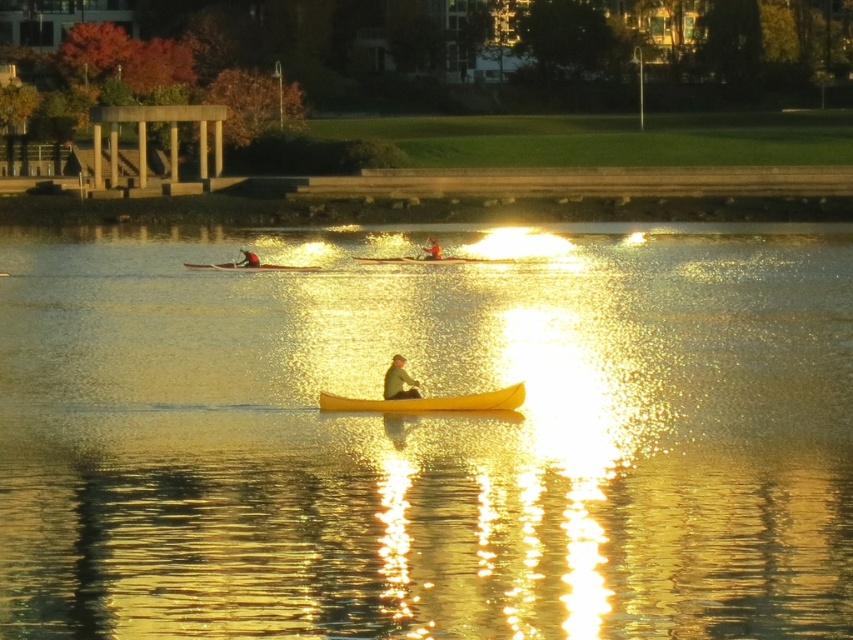
You are standing at the camera position and want to throw a lifebuoy to the person in the yellow matte canoe at center. The lifebuoy can travel 25 meters. Will it reach them?

The yellow matte canoe at center is 28.45 meters from the camera. Since the lifebuoy can only travel 25 meters, it will not reach them.

You are a photographer trying to capture a clear shot of the yellow matte canoe at center and the green fabric jacket at center. Since you want to focus on the larger object, which one should you zoom in on?

The yellow matte canoe at center is larger in size than the green fabric jacket at center, so you should zoom in on the yellow matte canoe at center.

You are standing at the edge of the water in the park scene. There is a specific point marked at coordinates point (x=798, y=634). If you want to reach this point without getting wet, what is the closest distance you can approach it while staying on dry land?

The point (x=798, y=634) is 53.43 feet away from the viewer. Since you need to stay on dry land, the closest you can approach is 53.43 feet from your current position.